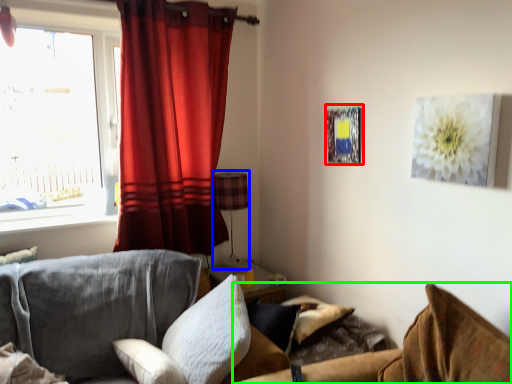
Question: Considering the real-world distances, which object is farthest from picture frame (highlighted by a red box)? lamp (highlighted by a blue box) or couch (highlighted by a green box)?

Choices:
 (A) lamp
 (B) couch

Answer: (B)